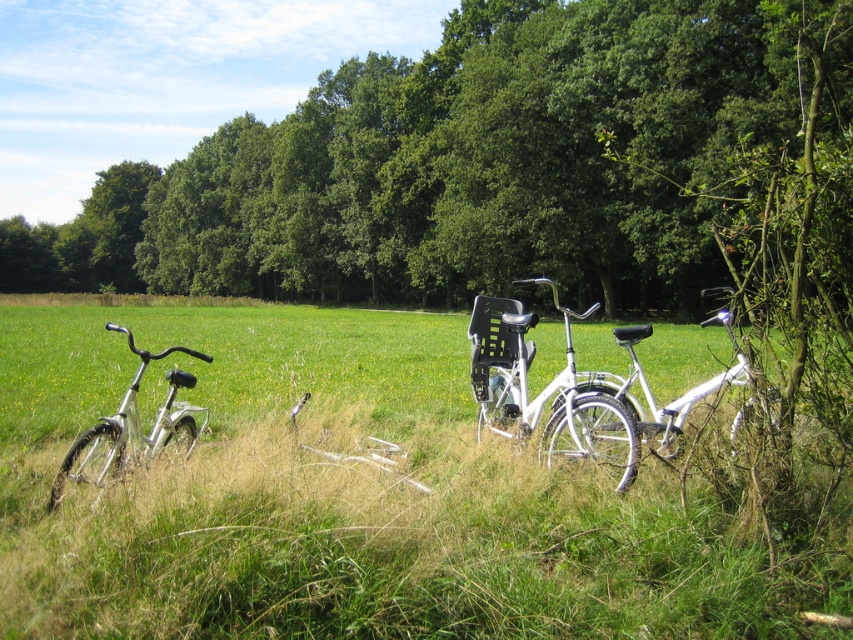
Question: Does white matte bicycle at center appear on the left side of silver metallic bicycle at left?

Choices:
 (A) yes
 (B) no

Answer: (B)

Question: Is green leafy tree at center below white matte bicycle at right?

Choices:
 (A) yes
 (B) no

Answer: (B)

Question: Which point is farther from the camera taking this photo?

Choices:
 (A) (543, 282)
 (B) (97, 481)
 (C) (752, 134)
 (D) (619, 378)

Answer: (A)

Question: Can you confirm if green leafy tree at center is wider than silver metallic bicycle at left?

Choices:
 (A) yes
 (B) no

Answer: (A)

Question: Estimate the real-world distances between objects in this image. Which object is farther from the silver metallic bicycle at left?

Choices:
 (A) green leafy tree at center
 (B) white matte bicycle at right
 (C) white matte bicycle at center

Answer: (A)

Question: Which of the following is the closest to the observer?

Choices:
 (A) white matte bicycle at right
 (B) white matte bicycle at center
 (C) green leafy tree at center
 (D) silver metallic bicycle at left

Answer: (D)